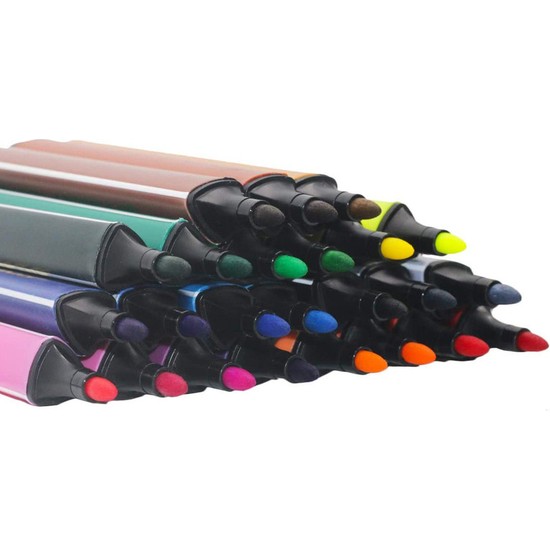
Locate an element on the screen. 4 yellow and green markers is located at coordinates (399, 249), (451, 243), (337, 261), (286, 269).